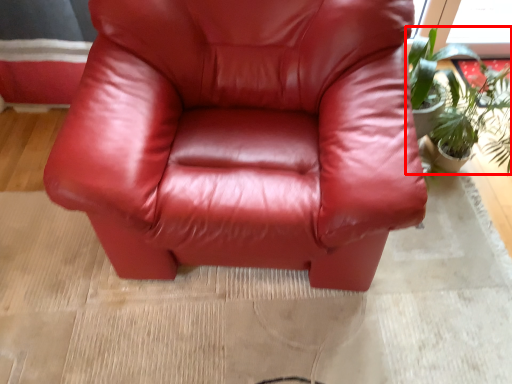
Question: In this image, where is houseplant (annotated by the red box) located relative to chair?

Choices:
 (A) left
 (B) right

Answer: (B)